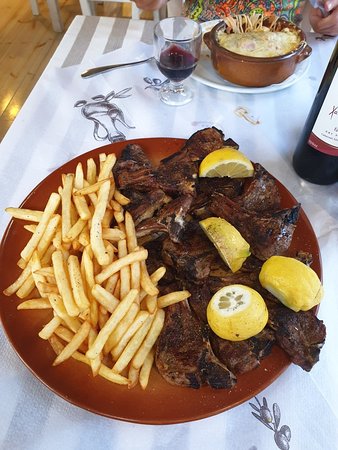
Locate an element on the screen. bottle is located at coordinates (323, 150).